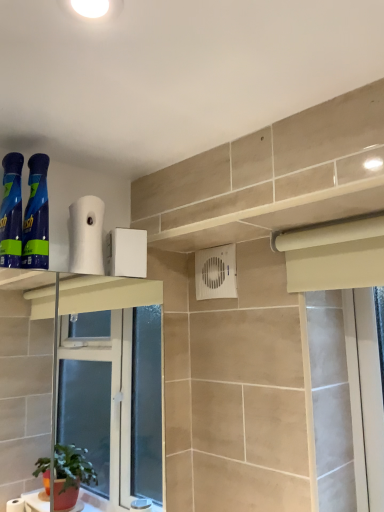
Question: From the image's perspective, would you say white plastic air conditioning unit at center is positioned over blue glossy spray can at left, which ranks as the 2th cleaning product in right-to-left order?

Choices:
 (A) yes
 (B) no

Answer: (B)

Question: Can you confirm if white plastic air conditioning unit at center is positioned to the left of blue glossy spray can at left, placed as the first cleaning product when sorted from left to right?

Choices:
 (A) no
 (B) yes

Answer: (A)

Question: From the image's perspective, does white plastic air conditioning unit at center appear lower than blue glossy spray can at left, placed as the first cleaning product when sorted from left to right?

Choices:
 (A) yes
 (B) no

Answer: (A)

Question: From a real-world perspective, is white plastic air conditioning unit at center physically above blue glossy spray can at left, placed as the first cleaning product when sorted from left to right?

Choices:
 (A) no
 (B) yes

Answer: (A)

Question: Is white plastic air conditioning unit at center at the right side of blue glossy spray can at left, which ranks as the 2th cleaning product in right-to-left order?

Choices:
 (A) no
 (B) yes

Answer: (B)

Question: Based on their positions, is white matte toilet paper at upper center located to the left or right of blue glossy spray can at left, placed as the first cleaning product when sorted from left to right?

Choices:
 (A) right
 (B) left

Answer: (A)

Question: Considering the positions of point (72, 206) and point (13, 222), is point (72, 206) closer or farther from the camera than point (13, 222)?

Choices:
 (A) closer
 (B) farther

Answer: (B)

Question: Is white matte toilet paper at upper center in front of or behind blue glossy spray can at left, which ranks as the 2th cleaning product in right-to-left order, in the image?

Choices:
 (A) front
 (B) behind

Answer: (B)

Question: Which is correct: white matte toilet paper at upper center is inside blue glossy spray can at left, which ranks as the 2th cleaning product in right-to-left order, or outside of it?

Choices:
 (A) inside
 (B) outside

Answer: (B)

Question: Is white plastic air conditioning unit at center spatially inside blue glossy spray can at left, placed as the first cleaning product when sorted from left to right, or outside of it?

Choices:
 (A) outside
 (B) inside

Answer: (A)

Question: Considering their positions, is white plastic air conditioning unit at center located in front of or behind blue glossy spray can at left, placed as the first cleaning product when sorted from left to right?

Choices:
 (A) front
 (B) behind

Answer: (B)

Question: Considering the positions of white plastic air conditioning unit at center and blue glossy spray can at left, placed as the first cleaning product when sorted from left to right, in the image, is white plastic air conditioning unit at center taller or shorter than blue glossy spray can at left, placed as the first cleaning product when sorted from left to right,?

Choices:
 (A) tall
 (B) short

Answer: (B)

Question: Looking at their shapes, would you say white plastic air conditioning unit at center is wider or thinner than blue glossy spray can at left, placed as the first cleaning product when sorted from left to right?

Choices:
 (A) thin
 (B) wide

Answer: (A)

Question: Choose the correct answer: Is blue glossy spray bottles at left, which ranks as the first cleaning product in right-to-left order, inside white plastic air conditioning unit at center or outside it?

Choices:
 (A) outside
 (B) inside

Answer: (A)

Question: In the image, is blue glossy spray bottles at left, which ranks as the first cleaning product in right-to-left order, positioned in front of or behind white plastic air conditioning unit at center?

Choices:
 (A) front
 (B) behind

Answer: (A)